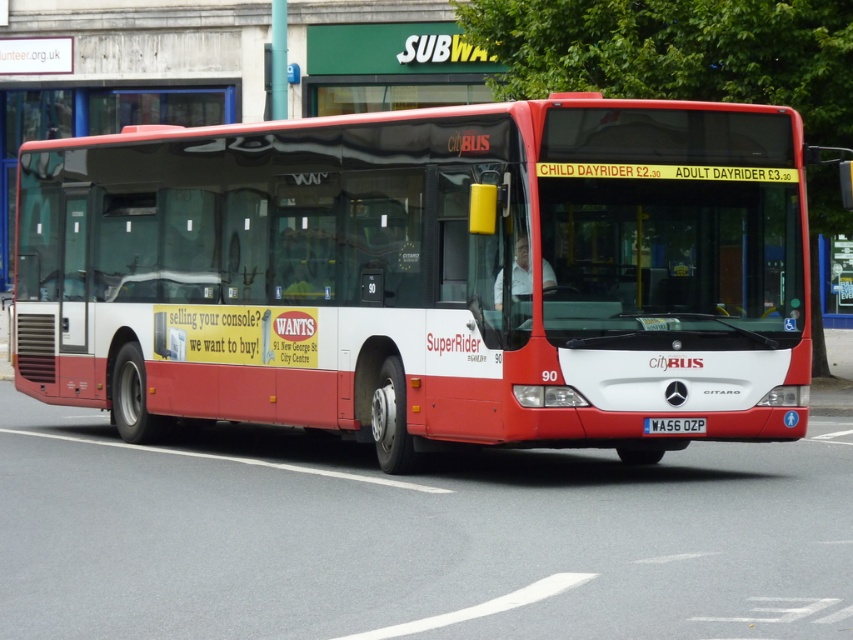
You are a pedestrian standing at the point marked by the coordinates point (x=427, y=275). You want to cross the road safely. The bus is moving forward. In which direction should you move to stay out of the bus path?

The point (x=427, y=275) marks the matte red bus at center. Since the bus is at the center and moving forward, you should move to either the left or right side away from the bus to stay out of its path.

You are a pedestrian standing on the sidewalk. You see the matte red bus at center and the white plastic license plate at center. Which object is nearer to you?

The matte red bus at center is closer to the viewer than the white plastic license plate at center, so the matte red bus at center is nearer to you.

You are a pedestrian standing at the origin point of the coordinate system. There is a matte red bus at center. Can you determine the direction of the bus relative to your position?

The matte red bus at center is located at point (427, 275), which means it is northeast of your position at the origin. Therefore, the bus is to your northeast direction.